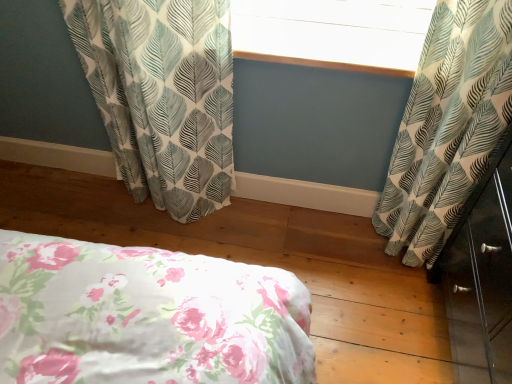
Question: From the image's perspective, is white textured window screen at upper center positioned above or below white leaf-patterned curtain at left, which is the second curtain in right-to-left order?

Choices:
 (A) above
 (B) below

Answer: (A)

Question: Based on their positions, is white textured window screen at upper center located to the left or right of white leaf-patterned curtain at left, marked as the first curtain in a left-to-right arrangement?

Choices:
 (A) left
 (B) right

Answer: (B)

Question: Estimate the real-world distances between objects in this image. Which object is closer to the white leaf-patterned curtain at right, which ranks as the first curtain in right-to-left order?

Choices:
 (A) white textured window screen at upper center
 (B) white leaf-patterned curtain at left, which is the second curtain in right-to-left order

Answer: (A)

Question: Which is farther from the white leaf-patterned curtain at right, which ranks as the first curtain in right-to-left order?

Choices:
 (A) white leaf-patterned curtain at left, which is the second curtain in right-to-left order
 (B) white textured window screen at upper center

Answer: (A)